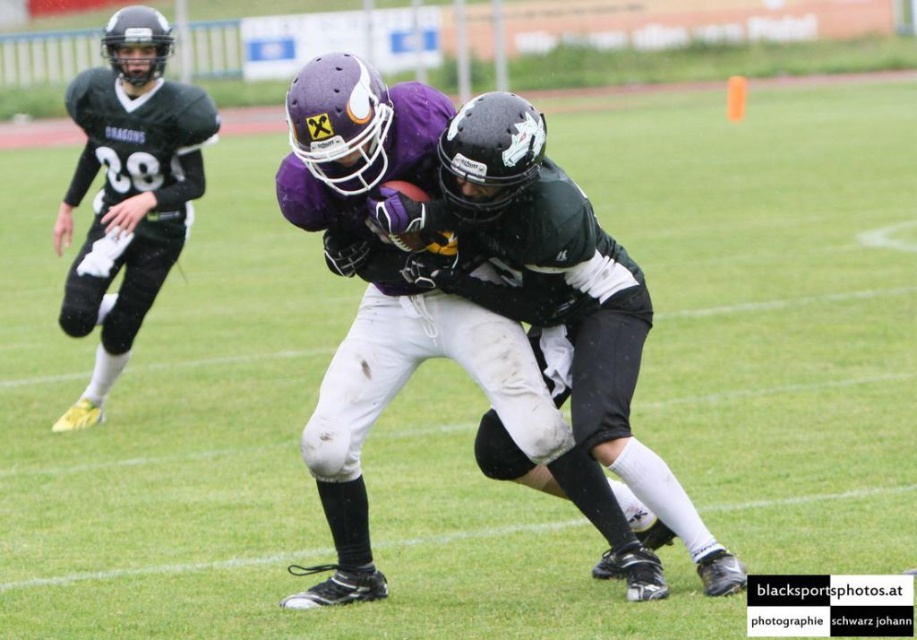
Locate an element on the screen. This screenshot has width=917, height=640. purple matte football helmet at center is located at coordinates (407, 320).

Is purple matte football helmet at center to the left of matte black jersey at left from the viewer's perspective?

No, purple matte football helmet at center is not to the left of matte black jersey at left.

You are a GUI agent. You are given a task and a screenshot of the screen. Output one action in this format:
    pyautogui.click(x=<x>, y=<y>)
    Task: Click on the purple matte football helmet at center
    The height and width of the screenshot is (640, 917).
    Given the screenshot: What is the action you would take?
    pyautogui.click(x=407, y=320)